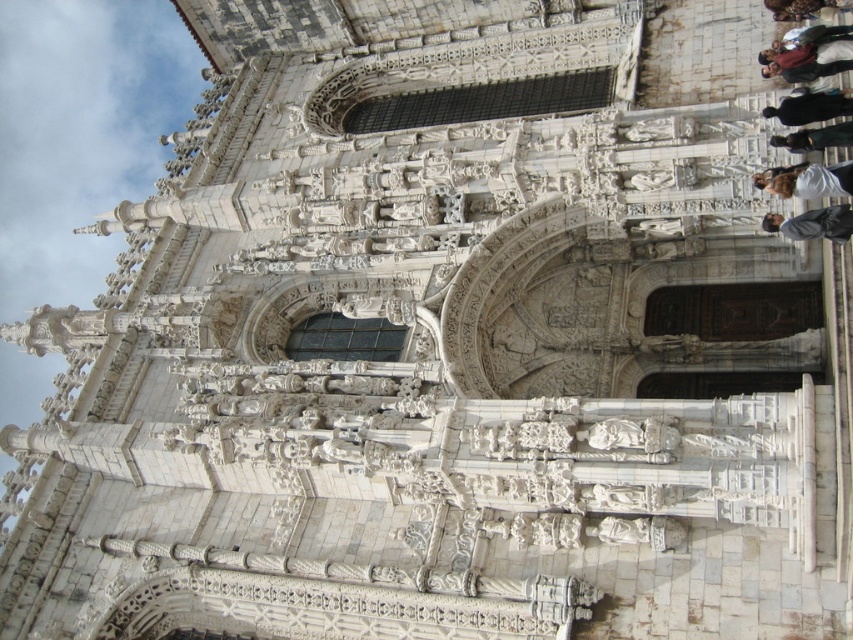
Looking at this image, you are a fashion designer observing the historic building facade and notice two outfits displayed on mannequins. The outfits are the dark brown leather jacket at upper right and the dark gray suit at center. Which outfit is positioned more to the right side of the facade?

The dark brown leather jacket at upper right is positioned more to the right side of the facade because it is on the right side of the dark gray suit at center.